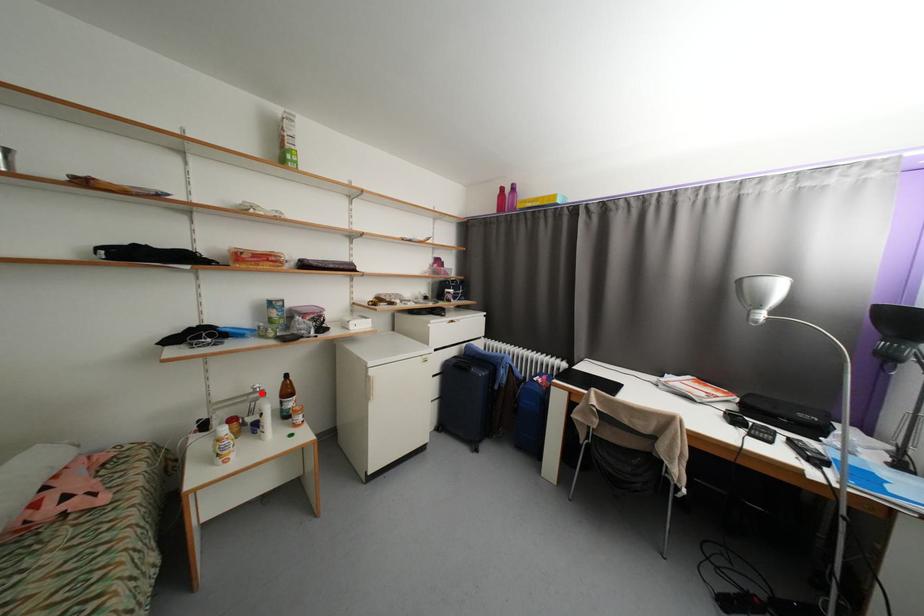
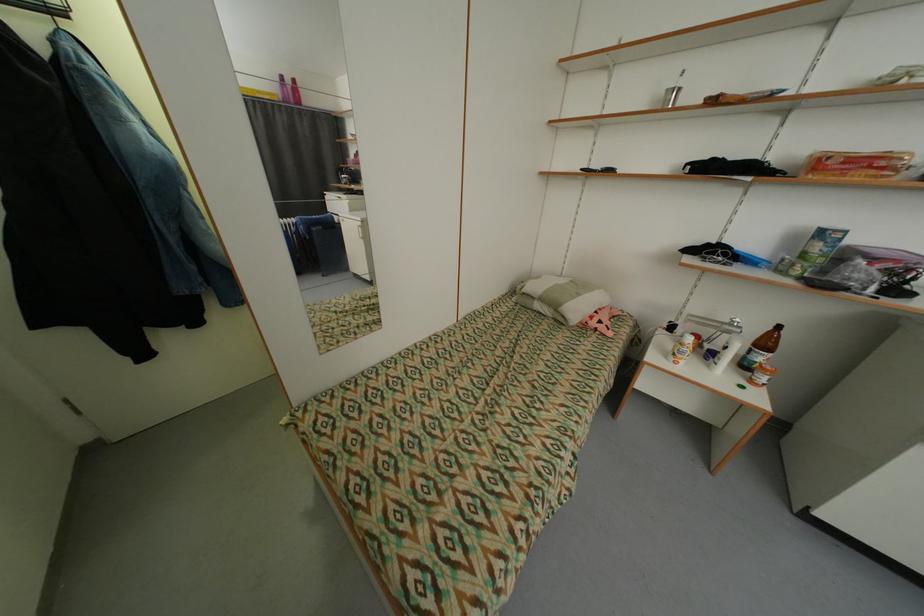
In the second image, find the point that corresponds to the highlighted location in the first image.

(736, 326)